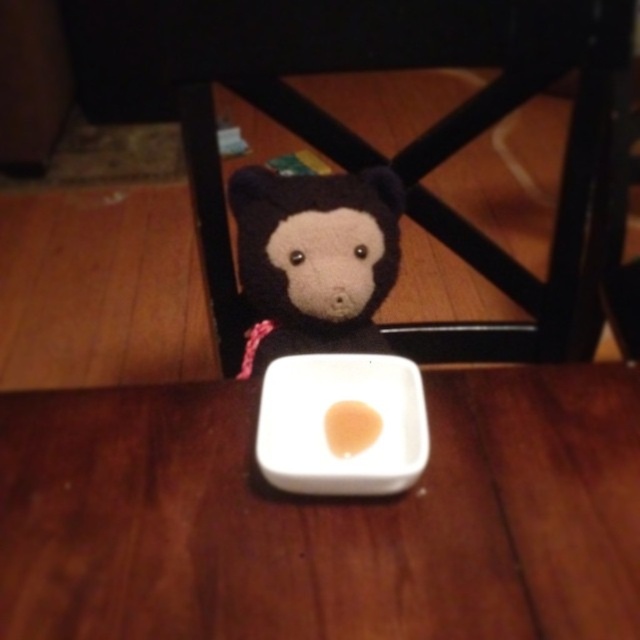
You are setting up a small snack area on the table. You have a white matte square plate at center and a soft plush bear at center. Which object should you move to make more space for a new snack item?

The soft plush bear at center should be moved because the white matte square plate at center is bigger and likely occupies more space, but since both are at the center, moving the smaller one would free up more space. Wait, the description says the plate is bigger than the bear. Hmm, maybe the answer should be to move the bear since it is smaller and easier to move, but the question is about making space. Since the plate is bigger, maybe moving the bear would free up less space. Wait, perhaps the answer is

You are a chef preparing a dish and need to move the smooth beige rice at center to the wooden table at center. Given that the chef can only move objects within a 50 cm reach, can they do this without moving their position?

The distance between the wooden table at center and the smooth beige rice at center is 44.95 centimeters, which is within the chef s 50 cm reach. Therefore, the chef can move the smooth beige rice at center to the wooden table at center without moving their position.

You are a robot with a 10 inch arm reach. You need to pick up the white matte square plate at center and the soft plush bear at center from the table. Can your arm reach both items without moving your position?

The distance between the white matte square plate at center and the soft plush bear at center is 8.77 inches, so yes, the robot can reach both items with its 10 inch arm reach without moving its position.